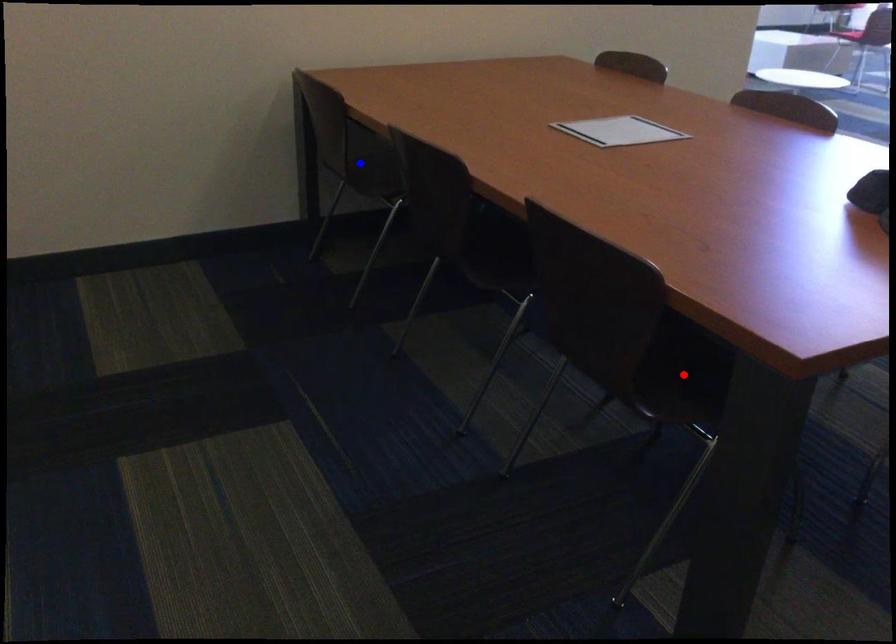
Question: In the image, two points are highlighted. Which point is nearer to the camera? Reply with the corresponding letter.

Choices:
 (A) blue point
 (B) red point

Answer: (B)